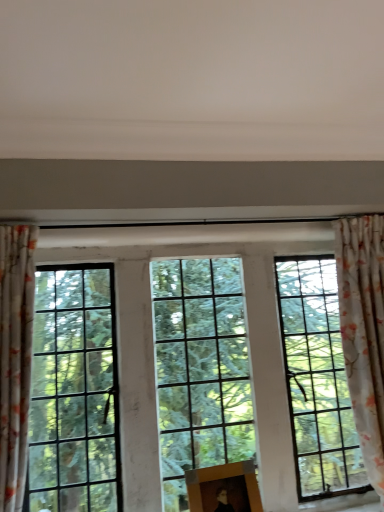
In order to click on floral fabric curtain at left, positioned as the first curtain in front-to-back order in this screenshot , I will do `click(15, 358)`.

The image size is (384, 512). Describe the element at coordinates (153, 334) in the screenshot. I see `clear glass window at center` at that location.

You are a GUI agent. You are given a task and a screenshot of the screen. Output one action in this format:
    pyautogui.click(x=<x>, y=<y>)
    Task: Click on the floral fabric curtain at left, which is the 2th curtain from back to front
    The height and width of the screenshot is (512, 384).
    Given the screenshot: What is the action you would take?
    pyautogui.click(x=15, y=358)

From the image's perspective, does floral fabric curtain at left, positioned as the first curtain in left-to-right order, appear higher than clear glass window at center?

Yes, from the image's perspective, floral fabric curtain at left, positioned as the first curtain in left-to-right order, is on top of clear glass window at center.

Is point (21, 310) less distant than point (148, 292)?

Yes.

Based on the photo, is floral fabric curtain at left, positioned as the first curtain in front-to-back order, placed right next to clear glass window at center?

floral fabric curtain at left, positioned as the first curtain in front-to-back order, and clear glass window at center are clearly separated.

From the image's perspective, is wooden picture frame at center above or below clear glass window at center?

Based on their image positions, wooden picture frame at center is located beneath clear glass window at center.

Where is `window behind the wooden picture frame at center`? The image size is (384, 512). window behind the wooden picture frame at center is located at coordinates point(153,334).

Is wooden picture frame at center far away from clear glass window at center?

Actually, wooden picture frame at center and clear glass window at center are a little close together.

Can you see floral fabric curtain at right, positioned as the first curtain in right-to-left order, touching floral fabric curtain at left, the second curtain positioned from the right?

No, floral fabric curtain at right, positioned as the first curtain in right-to-left order, is not making contact with floral fabric curtain at left, the second curtain positioned from the right.

From the picture: Between floral fabric curtain at right, positioned as the first curtain in right-to-left order, and floral fabric curtain at left, the second curtain positioned from the right, which one appears on the right side from the viewer's perspective?

floral fabric curtain at right, positioned as the first curtain in right-to-left order.

Between floral fabric curtain at right, which is the 2th curtain from front to back, and floral fabric curtain at left, positioned as the first curtain in left-to-right order, which one is positioned in front?

floral fabric curtain at left, positioned as the first curtain in left-to-right order, is closer to the camera.

Image resolution: width=384 pixels, height=512 pixels. I want to click on picture frame below the floral fabric curtain at left, which is the 2th curtain from back to front (from the image's perspective), so click(x=224, y=487).

Can you confirm if floral fabric curtain at left, which is the 2th curtain from back to front, is thinner than wooden picture frame at center?

Incorrect, the width of floral fabric curtain at left, which is the 2th curtain from back to front, is not less than that of wooden picture frame at center.

Does floral fabric curtain at left, positioned as the first curtain in left-to-right order, have a larger size compared to wooden picture frame at center?

Correct, floral fabric curtain at left, positioned as the first curtain in left-to-right order, is larger in size than wooden picture frame at center.

From a real-world perspective, is clear glass window at center located beneath floral fabric curtain at right, positioned as the first curtain in right-to-left order?

Yes, from a real-world perspective, clear glass window at center is below floral fabric curtain at right, positioned as the first curtain in right-to-left order.

Is clear glass window at center with floral fabric curtain at right, marked as the first curtain in a back-to-front arrangement?

There is a gap between clear glass window at center and floral fabric curtain at right, marked as the first curtain in a back-to-front arrangement.

Do you think clear glass window at center is within floral fabric curtain at right, marked as the first curtain in a back-to-front arrangement, or outside of it?

clear glass window at center is spatially situated outside floral fabric curtain at right, marked as the first curtain in a back-to-front arrangement.

From the image's perspective, is floral fabric curtain at left, the second curtain positioned from the right, below floral fabric curtain at right, positioned as the first curtain in right-to-left order?

Incorrect, from the image's perspective, floral fabric curtain at left, the second curtain positioned from the right, is higher than floral fabric curtain at right, positioned as the first curtain in right-to-left order.

Can you confirm if floral fabric curtain at left, positioned as the first curtain in front-to-back order, is positioned to the left of floral fabric curtain at right, which is the 2th curtain from front to back?

Yes, floral fabric curtain at left, positioned as the first curtain in front-to-back order, is to the left of floral fabric curtain at right, which is the 2th curtain from front to back.

Choose the correct answer: Is floral fabric curtain at left, the second curtain positioned from the right, inside floral fabric curtain at right, positioned as the first curtain in right-to-left order, or outside it?

floral fabric curtain at left, the second curtain positioned from the right, is not inside floral fabric curtain at right, positioned as the first curtain in right-to-left order, it's outside.

Does clear glass window at center touch wooden picture frame at center?

No, clear glass window at center is not beside wooden picture frame at center.

In terms of height, does clear glass window at center look taller or shorter compared to wooden picture frame at center?

Clearly, clear glass window at center is taller compared to wooden picture frame at center.

Choose the correct answer: Is clear glass window at center inside wooden picture frame at center or outside it?

clear glass window at center exists outside the volume of wooden picture frame at center.

Identify the location of curtain on the left of clear glass window at center. (15, 358).

The height and width of the screenshot is (512, 384). I want to click on picture frame on the right of clear glass window at center, so click(x=224, y=487).

From the image, which object appears to be nearer to wooden picture frame at center, floral fabric curtain at right, which appears as the second curtain when viewed from the left, or floral fabric curtain at left, positioned as the first curtain in front-to-back order?

Among the two, floral fabric curtain at right, which appears as the second curtain when viewed from the left, is located nearer to wooden picture frame at center.

Considering their positions, is floral fabric curtain at left, which is the 2th curtain from back to front, positioned further to wooden picture frame at center than clear glass window at center?

Based on the image, floral fabric curtain at left, which is the 2th curtain from back to front, appears to be further to wooden picture frame at center.

From the image, which object appears to be farther from wooden picture frame at center, clear glass window at center or floral fabric curtain at left, the second curtain positioned from the right?

Based on the image, floral fabric curtain at left, the second curtain positioned from the right, appears to be further to wooden picture frame at center.

Based on their spatial positions, is floral fabric curtain at right, which appears as the second curtain when viewed from the left, or wooden picture frame at center closer to clear glass window at center?

floral fabric curtain at right, which appears as the second curtain when viewed from the left, is closer to clear glass window at center.

Considering their positions, is floral fabric curtain at right, which is the 2th curtain from front to back, positioned further to wooden picture frame at center than clear glass window at center?

floral fabric curtain at right, which is the 2th curtain from front to back, is further to wooden picture frame at center.

When comparing their distances from floral fabric curtain at left, which is the 2th curtain from back to front, does floral fabric curtain at right, which appears as the second curtain when viewed from the left, or clear glass window at center seem closer?

clear glass window at center is positioned closer to the anchor floral fabric curtain at left, which is the 2th curtain from back to front.

Considering their positions, is floral fabric curtain at left, the second curtain positioned from the right, positioned further to wooden picture frame at center than floral fabric curtain at right, positioned as the first curtain in right-to-left order?

floral fabric curtain at left, the second curtain positioned from the right.

When comparing their distances from floral fabric curtain at left, which is the 2th curtain from back to front, does wooden picture frame at center or floral fabric curtain at right, positioned as the first curtain in right-to-left order, seem further?

The object further to floral fabric curtain at left, which is the 2th curtain from back to front, is floral fabric curtain at right, positioned as the first curtain in right-to-left order.

At what (x,y) coordinates should I click in order to perform the action: click on picture frame located between floral fabric curtain at left, the second curtain positioned from the right, and floral fabric curtain at right, marked as the first curtain in a back-to-front arrangement, in the left-right direction. Please return your answer as a coordinate pair (x, y). The height and width of the screenshot is (512, 384). Looking at the image, I should click on (224, 487).

You are a GUI agent. You are given a task and a screenshot of the screen. Output one action in this format:
    pyautogui.click(x=<x>, y=<y>)
    Task: Click on the window between floral fabric curtain at left, the second curtain positioned from the right, and wooden picture frame at center from left to right
    The image size is (384, 512).
    Given the screenshot: What is the action you would take?
    pyautogui.click(x=153, y=334)

Find the location of a particular element. The width and height of the screenshot is (384, 512). window between floral fabric curtain at left, which is the 2th curtain from back to front, and floral fabric curtain at right, marked as the first curtain in a back-to-front arrangement is located at coordinates (153, 334).

Locate an element on the screen. picture frame between clear glass window at center and floral fabric curtain at right, which appears as the second curtain when viewed from the left is located at coordinates (224, 487).